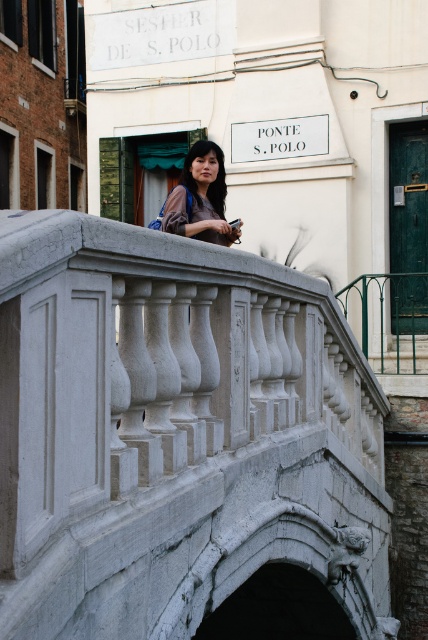
Question: Is matte black bag at center positioned at the back of matte black hair at upper center?

Choices:
 (A) no
 (B) yes

Answer: (A)

Question: Is white stone bridge at center to the right of matte black hair at upper center from the viewer's perspective?

Choices:
 (A) no
 (B) yes

Answer: (A)

Question: Is matte black bag at center thinner than matte black hair at upper center?

Choices:
 (A) yes
 (B) no

Answer: (B)

Question: Which object is farther from the camera taking this photo?

Choices:
 (A) matte black bag at center
 (B) matte black hair at upper center
 (C) white stone bridge at center

Answer: (B)

Question: Estimate the real-world distances between objects in this image. Which object is farther from the matte black bag at center?

Choices:
 (A) matte black hair at upper center
 (B) white stone bridge at center

Answer: (B)

Question: Which point is closer to the camera?

Choices:
 (A) matte black hair at upper center
 (B) matte black bag at center
 (C) white stone bridge at center

Answer: (C)